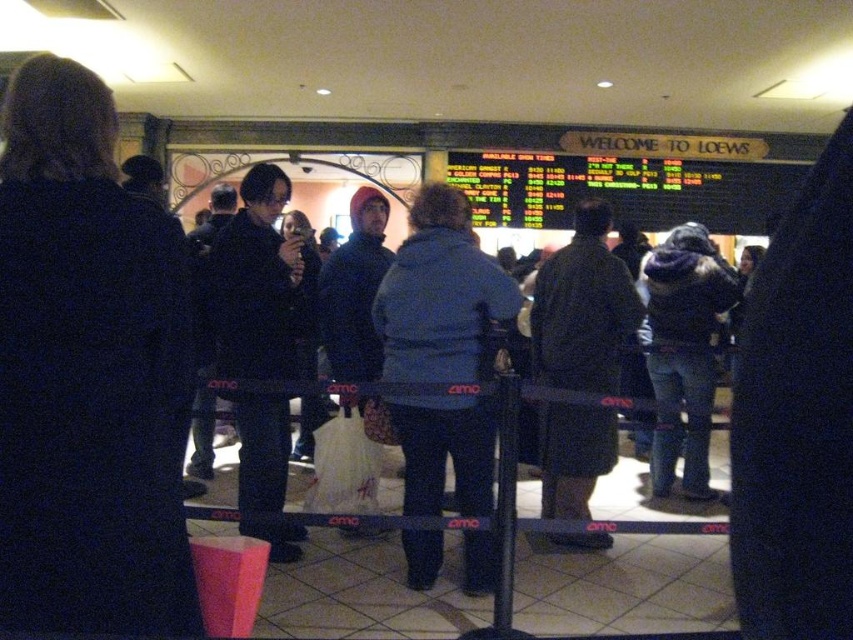
Can you confirm if dark blue coat at center is bigger than denim jacket at center?

No.

Who is more forward, (119, 618) or (689, 352)?

Point (119, 618)

Does point (119, 589) come closer to viewer compared to point (651, 353)?

Yes, it is.

Image resolution: width=853 pixels, height=640 pixels. What are the coordinates of `dark blue coat at center` in the screenshot? It's located at [86, 372].

Locate an element on the screen. dark blue coat at center is located at coordinates (86, 372).

Is the position of dark blue coat at center more distant than that of blue fleece jacket at center?

No, dark blue coat at center is in front of blue fleece jacket at center.

I want to click on dark blue coat at center, so point(86,372).

Is dark blue coat at center smaller than dark brown coat at center?

Indeed, dark blue coat at center has a smaller size compared to dark brown coat at center.

Describe the element at coordinates (86, 372) in the screenshot. Image resolution: width=853 pixels, height=640 pixels. I see `dark blue coat at center` at that location.

Is point (97, 481) positioned before point (589, 301)?

Yes, it is in front of point (589, 301).

Identify the location of dark blue coat at center. (86, 372).